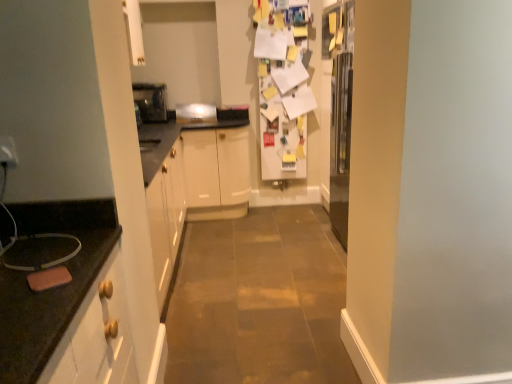
Question: Is metallic silver toaster at center, positioned as the 2th appliance in right-to-left order, inside the boundaries of satin silver toaster at center, the 2th appliance from the left, or outside?

Choices:
 (A) outside
 (B) inside

Answer: (A)

Question: Is metallic silver toaster at center, positioned as the 2th appliance in right-to-left order, wider or thinner than satin silver toaster at center, the 2th appliance from the left?

Choices:
 (A) wide
 (B) thin

Answer: (A)

Question: In terms of size, does metallic silver toaster at center, acting as the 1th appliance starting from the left, appear bigger or smaller than satin silver toaster at center, the 2th appliance from the left?

Choices:
 (A) small
 (B) big

Answer: (B)

Question: Based on their sizes in the image, would you say satin silver toaster at center, marked as the first appliance in a right-to-left arrangement, is bigger or smaller than metallic silver toaster at center, positioned as the 2th appliance in right-to-left order?

Choices:
 (A) big
 (B) small

Answer: (B)

Question: Considering their positions, is satin silver toaster at center, the 2th appliance from the left, located in front of or behind metallic silver toaster at center, acting as the 1th appliance starting from the left?

Choices:
 (A) front
 (B) behind

Answer: (B)

Question: Is satin silver toaster at center, the 2th appliance from the left, inside the boundaries of metallic silver toaster at center, acting as the 1th appliance starting from the left, or outside?

Choices:
 (A) outside
 (B) inside

Answer: (A)

Question: Considering the positions of satin silver toaster at center, marked as the first appliance in a right-to-left arrangement, and metallic silver toaster at center, positioned as the 2th appliance in right-to-left order, in the image, is satin silver toaster at center, marked as the first appliance in a right-to-left arrangement, taller or shorter than metallic silver toaster at center, positioned as the 2th appliance in right-to-left order,?

Choices:
 (A) tall
 (B) short

Answer: (B)